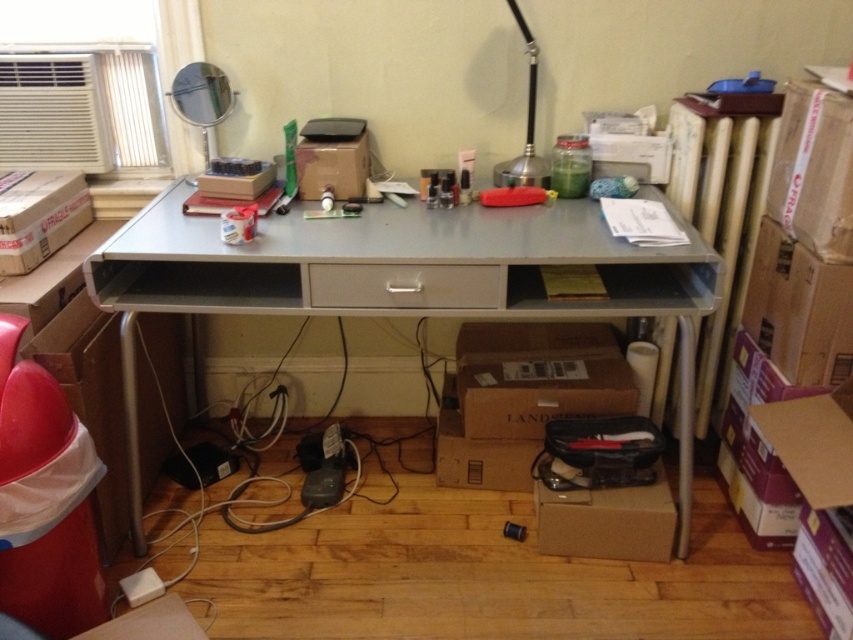
Question: Is metallic gray desk at center to the left of matte cardboard box at center from the viewer's perspective?

Choices:
 (A) yes
 (B) no

Answer: (B)

Question: Considering the relative positions of cardboard box at left and black metallic lamp at upper right in the image provided, where is cardboard box at left located with respect to black metallic lamp at upper right?

Choices:
 (A) right
 (B) left

Answer: (B)

Question: Is metallic gray desk at center to the left of matte cardboard box at center from the viewer's perspective?

Choices:
 (A) yes
 (B) no

Answer: (B)

Question: Estimate the real-world distances between objects in this image. Which object is farther from the brown cardboard box at right?

Choices:
 (A) metallic gray desk at center
 (B) cardboard box at left

Answer: (B)

Question: Estimate the real-world distances between objects in this image. Which object is closer to the metallic gray desk at center?

Choices:
 (A) brown cardboard box at lower right
 (B) cardboard box at lower center
 (C) cardboard box at left

Answer: (B)

Question: Which point is farther to the camera?

Choices:
 (A) (146, 282)
 (B) (15, 204)

Answer: (B)